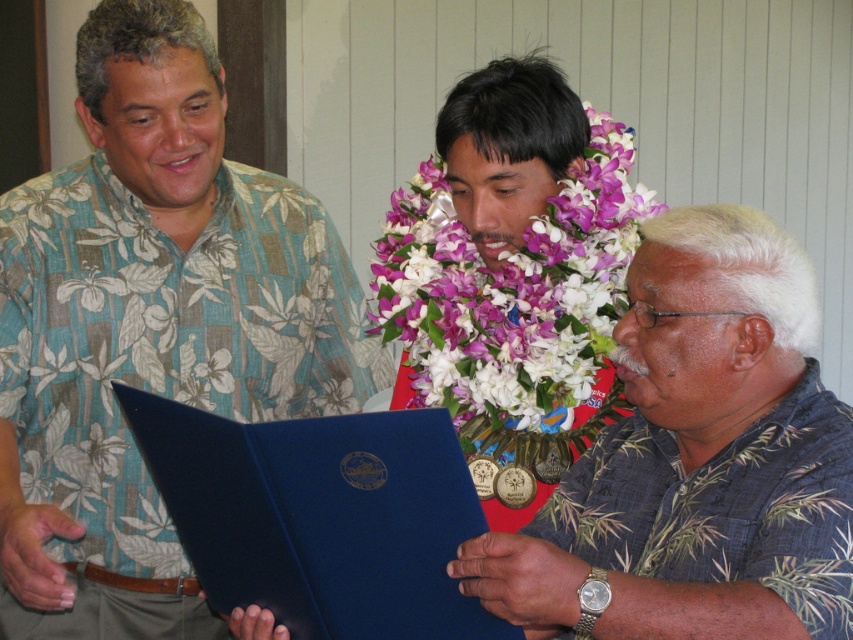
Based on the scene description, what object is located at the coordinate point (697, 460)?

The blue fabric folder at center is located at the coordinate point (697, 460).

In the scene described, there are two blue items at the center of the image. The blue fabric folder at center and the blue leather book at center. Which one is positioned to the left?

The blue leather book at center is to the left of the blue fabric folder at center according to the description.